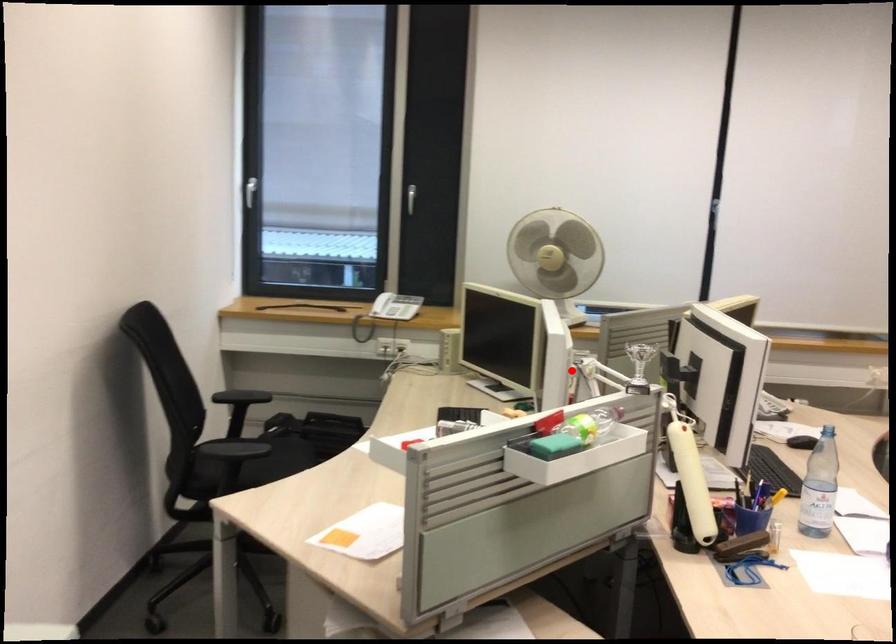
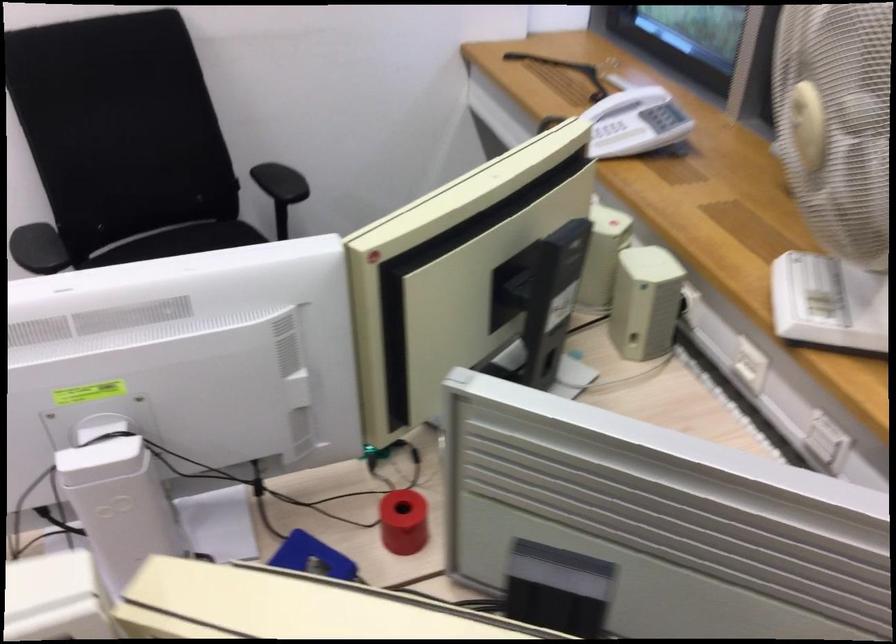
Question: I am providing you with two images of the same scene from different viewpoints. Image1 has a red point marked. In image2, the corresponding 3D location appears at what relative position? Reply with the corresponding letter.

Choices:
 (A) Closer
 (B) Farther

Answer: (A)